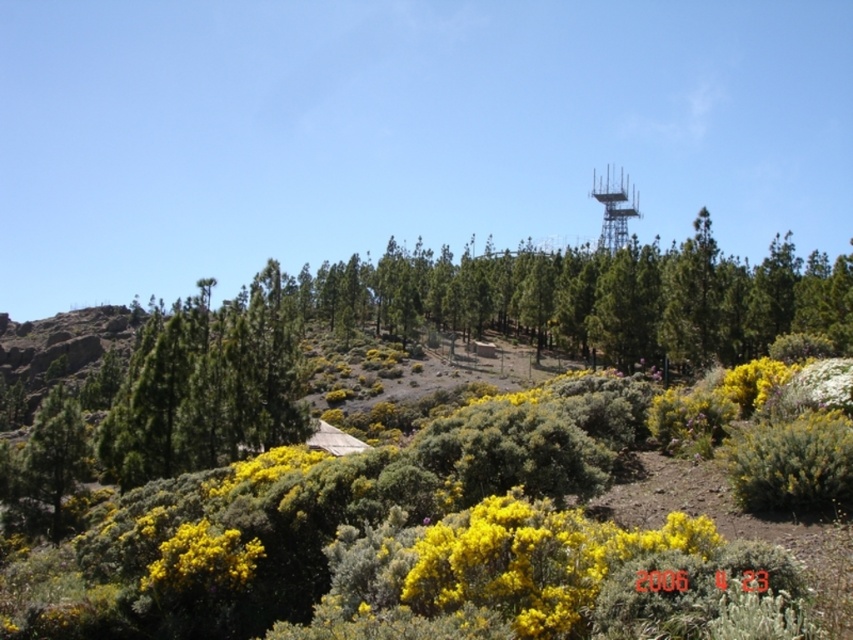
What do you see at coordinates (534, 561) in the screenshot?
I see `yellow matte flower at center` at bounding box center [534, 561].

Who is positioned more to the left, yellow matte flower at center or yellow fluffy bush at lower left?

yellow fluffy bush at lower left

Identify the location of yellow matte flower at center. Image resolution: width=853 pixels, height=640 pixels. (534, 561).